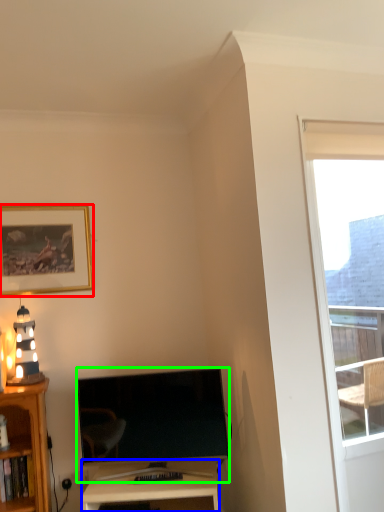
Question: Which object is positioned closest to picture frame (highlighted by a red box)? Select from desk (highlighted by a blue box) and television (highlighted by a green box).

Choices:
 (A) desk
 (B) television

Answer: (B)